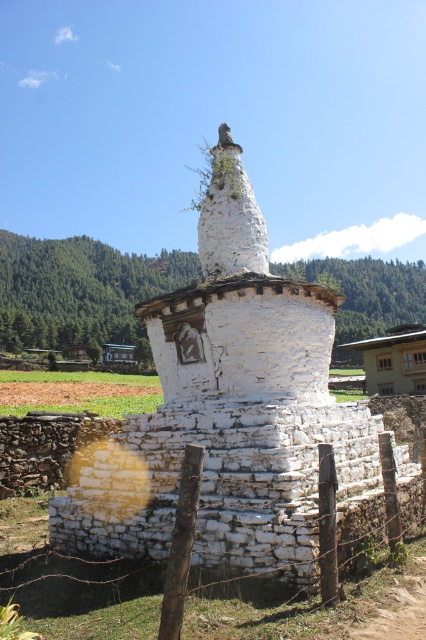
You are a visitor standing in front of the white stone stupa at center and the wooden post at center. You want to take a photo that includes both objects in the frame. Which object should you focus on to ensure both are visible?

You should focus on the white stone stupa at center because it is larger in size than the wooden post at center, so keeping it centered will allow the smaller wooden post at center to fit into the frame as well.